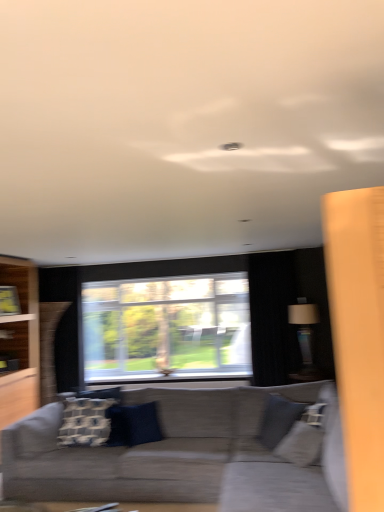
How much space does white textured pillow at center, which is counted as the first pillow, starting from the left, occupy vertically?

The height of white textured pillow at center, which is counted as the first pillow, starting from the left, is 24.00 inches.

What do you see at coordinates (273, 317) in the screenshot?
I see `black fabric curtain at right` at bounding box center [273, 317].

What is the approximate height of gray fabric swivel chair at lower right?

gray fabric swivel chair at lower right is 31.73 inches tall.

Describe the element at coordinates (193, 454) in the screenshot. This screenshot has width=384, height=512. I see `textured gray couch at center` at that location.

This screenshot has height=512, width=384. In order to click on textured gray couch at center in this screenshot , I will do `click(193, 454)`.

Find the location of a particular element. The image size is (384, 512). white textured pillow at center, which is counted as the first pillow, starting from the left is located at coordinates (85, 422).

Locate an element on the screen. Image resolution: width=384 pixels, height=512 pixels. studio couch on the right of white textured pillow at center, the 2th pillow positioned from the right is located at coordinates (193, 454).

From the image's perspective, is white textured pillow at center, the 2th pillow positioned from the right, under textured gray couch at center?

No, from the image's perspective, white textured pillow at center, the 2th pillow positioned from the right, is not below textured gray couch at center.

Which is farther from the camera, [60,442] or [276,455]?

The point [60,442] is farther from the camera.

Is white textured pillow at center, which is counted as the first pillow, starting from the left, facing towards textured gray couch at center?

Yes, white textured pillow at center, which is counted as the first pillow, starting from the left, faces towards textured gray couch at center.

Does white textured pillow at center, which is counted as the first pillow, starting from the left, come in front of matte black lampshade at right?

Yes, white textured pillow at center, which is counted as the first pillow, starting from the left, is in front of matte black lampshade at right.

How many degrees apart are the facing directions of white textured pillow at center, which is counted as the first pillow, starting from the left, and matte black lampshade at right?

There is a 89.4-degree angle between the facing directions of white textured pillow at center, which is counted as the first pillow, starting from the left, and matte black lampshade at right.

From a real-world perspective, is white textured pillow at center, which is counted as the first pillow, starting from the left, positioned under matte black lampshade at right based on gravity?

Indeed, from a real-world perspective, white textured pillow at center, which is counted as the first pillow, starting from the left, is positioned beneath matte black lampshade at right.

Which of these two, white textured pillow at center, which is counted as the first pillow, starting from the left, or matte black lampshade at right, is smaller?

white textured pillow at center, which is counted as the first pillow, starting from the left, is smaller.

Can you tell me how much textured gray couch at center and blue velvet pillow at center, which is the first pillow in right-to-left order, differ in facing direction?

The angle between the facing direction of textured gray couch at center and the facing direction of blue velvet pillow at center, which is the first pillow in right-to-left order, is 38.3 degrees.

Considering the sizes of textured gray couch at center and blue velvet pillow at center, which is the first pillow in right-to-left order, in the image, is textured gray couch at center bigger or smaller than blue velvet pillow at center, which is the first pillow in right-to-left order,?

Clearly, textured gray couch at center is larger in size than blue velvet pillow at center, which is the first pillow in right-to-left order.

Image resolution: width=384 pixels, height=512 pixels. Identify the location of studio couch in front of the blue velvet pillow at center, which is the first pillow in right-to-left order. (193, 454).

Is textured gray couch at center directly adjacent to blue velvet pillow at center, which is the first pillow in right-to-left order?

No, textured gray couch at center is not next to blue velvet pillow at center, which is the first pillow in right-to-left order.

From a real-world perspective, between gray fabric swivel chair at lower right and white textured pillow at center, which is counted as the first pillow, starting from the left, who is vertically lower?

gray fabric swivel chair at lower right is physically lower.

Is gray fabric swivel chair at lower right not inside white textured pillow at center, which is counted as the first pillow, starting from the left?

Absolutely, gray fabric swivel chair at lower right is external to white textured pillow at center, which is counted as the first pillow, starting from the left.

What are the coordinates of `the 2nd pillow above the gray fabric swivel chair at lower right (from a real-world perspective)` in the screenshot? It's located at (85, 422).

Is gray fabric swivel chair at lower right to the left or to the right of white textured pillow at center, the 2th pillow positioned from the right, in the image?

Clearly, gray fabric swivel chair at lower right is on the right of white textured pillow at center, the 2th pillow positioned from the right, in the image.

Is black fabric curtain at right positioned with its back to transparent glass window at center?

black fabric curtain at right is not turned away from transparent glass window at center.

The width and height of the screenshot is (384, 512). I want to click on window on the left side of black fabric curtain at right, so click(x=166, y=320).

Is black fabric curtain at right next to transparent glass window at center?

They are not placed beside each other.

From a real-world perspective, is black fabric curtain at right over transparent glass window at center?

Yes, from a real-world perspective, black fabric curtain at right is over transparent glass window at center

Are gray fabric swivel chair at lower right and blue velvet pillow at center, which appears as the second pillow when viewed from the left, far apart?

gray fabric swivel chair at lower right is positioned a significant distance from blue velvet pillow at center, which appears as the second pillow when viewed from the left.

From the image's perspective, would you say gray fabric swivel chair at lower right is positioned over blue velvet pillow at center, which appears as the second pillow when viewed from the left?

Yes.

This screenshot has height=512, width=384. I want to click on swivel chair in front of the blue velvet pillow at center, which appears as the second pillow when viewed from the left, so click(x=286, y=453).

From the image's perspective, which one is positioned higher, textured gray couch at center or black fabric curtain at right?

black fabric curtain at right.

Is point (165, 442) in front of point (283, 322)?

Yes, point (165, 442) is closer to viewer.

Is black fabric curtain at right located within textured gray couch at center?

That's incorrect, black fabric curtain at right is not inside textured gray couch at center.

Can you tell me how much textured gray couch at center and black fabric curtain at right differ in facing direction?

textured gray couch at center and black fabric curtain at right are facing 0.362 degrees away from each other.

What are the coordinates of `the 2nd pillow directly above the textured gray couch at center (from a real-world perspective)` in the screenshot? It's located at (85, 422).

Image resolution: width=384 pixels, height=512 pixels. Find the location of `lamp located above the white textured pillow at center, which is counted as the first pillow, starting from the left (from the image's perspective)`. lamp located above the white textured pillow at center, which is counted as the first pillow, starting from the left (from the image's perspective) is located at coordinates [304, 338].

Considering their positions, is white textured pillow at center, the 2th pillow positioned from the right, positioned closer to black fabric curtain at right than transparent glass window at center?

transparent glass window at center is positioned closer to the anchor black fabric curtain at right.

Estimate the real-world distances between objects in this image. Which object is closer to matte black lampshade at right, transparent glass window at center or textured gray couch at center?

transparent glass window at center lies closer to matte black lampshade at right than the other object.

When comparing their distances from matte black lampshade at right, does black fabric curtain at right or textured gray couch at center seem closer?

black fabric curtain at right is closer to matte black lampshade at right.

Considering their positions, is white textured pillow at center, which is counted as the first pillow, starting from the left, positioned closer to blue velvet pillow at center, which appears as the second pillow when viewed from the left, than textured gray couch at center?

white textured pillow at center, which is counted as the first pillow, starting from the left, is closer to blue velvet pillow at center, which appears as the second pillow when viewed from the left.

From the image, which object appears to be farther from matte black lampshade at right, transparent glass window at center or white textured pillow at center, which is counted as the first pillow, starting from the left?

Among the two, white textured pillow at center, which is counted as the first pillow, starting from the left, is located further to matte black lampshade at right.

When comparing their distances from gray fabric swivel chair at lower right, does white textured pillow at center, the 2th pillow positioned from the right, or transparent glass window at center seem closer?

Based on the image, white textured pillow at center, the 2th pillow positioned from the right, appears to be nearer to gray fabric swivel chair at lower right.

When comparing their distances from blue velvet pillow at center, which appears as the second pillow when viewed from the left, does transparent glass window at center or black fabric curtain at right seem further?

black fabric curtain at right is positioned further to the anchor blue velvet pillow at center, which appears as the second pillow when viewed from the left.

Looking at the image, which one is located further to gray fabric swivel chair at lower right, matte black lampshade at right or blue velvet pillow at center, which is the first pillow in right-to-left order?

Based on the image, matte black lampshade at right appears to be further to gray fabric swivel chair at lower right.

Identify the location of lamp between textured gray couch at center and transparent glass window at center in the front-back direction. The height and width of the screenshot is (512, 384). (304, 338).

Where is `window between white textured pillow at center, which is counted as the first pillow, starting from the left, and matte black lampshade at right`? The width and height of the screenshot is (384, 512). window between white textured pillow at center, which is counted as the first pillow, starting from the left, and matte black lampshade at right is located at coordinates (166, 320).

This screenshot has width=384, height=512. Identify the location of pillow situated between white textured pillow at center, the 2th pillow positioned from the right, and black fabric curtain at right from left to right. (133, 425).

This screenshot has width=384, height=512. Identify the location of swivel chair between textured gray couch at center and black fabric curtain at right in the front-back direction. (286, 453).